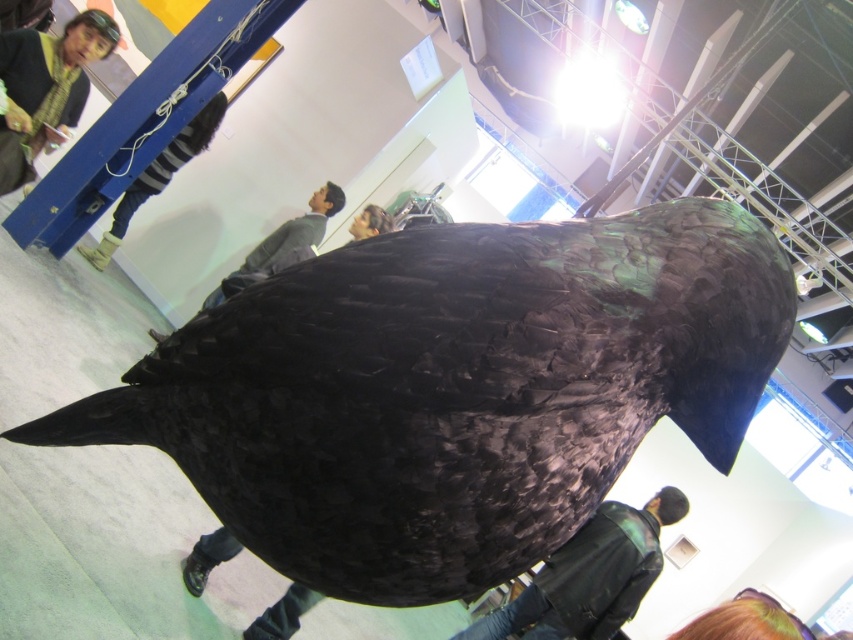
Based on the photo, what object is located at the coordinate point (157, 177) in the image?

The yellow rubber boot at upper left is located at the coordinate point (157, 177).

You are standing in the exhibition hall and want to take a photo of the shiny black bird at center. If you are positioned at the entrance, which is at point A, and the bird is at point B, what direction should you move to get closer to the bird?

Since the shiny black bird at center is located at point B, you should move towards the center of the exhibition hall to get closer to it.